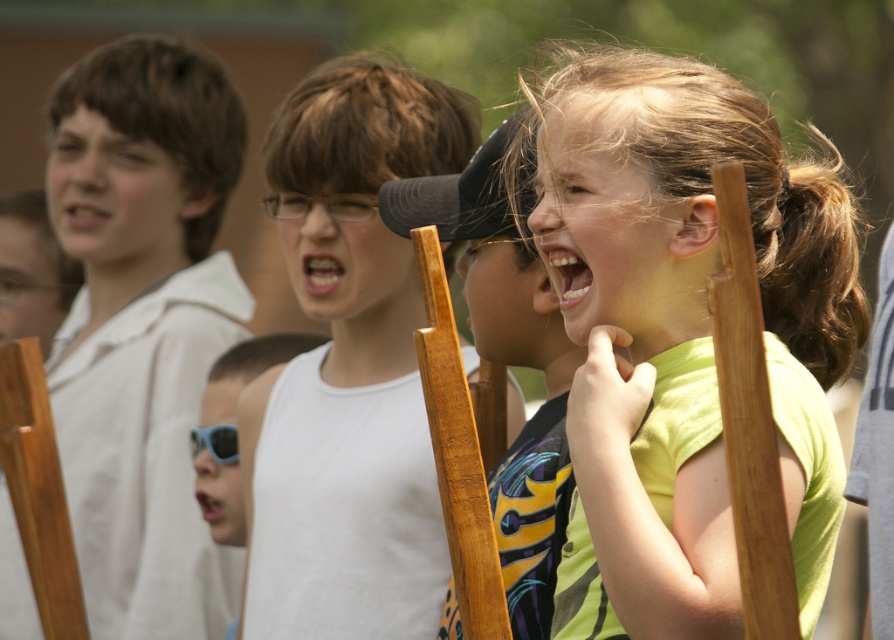
You are a photographer trying to capture a candid shot of the white matte tank top at center and the matte black cap at center. Which object should you adjust your focus on first to ensure both are in the frame?

The white matte tank top at center is closer to you than the matte black cap at center, so you should focus on the white matte tank top at center first to ensure both are in the frame.

You are a photographer setting up for a group photo. The green matte shirt at center and the matte black cap at center are part of the scene. If your camera has a minimum focus distance of 30 centimeters, can you focus on both objects simultaneously without needing to adjust the focus?

The green matte shirt at center and the matte black cap at center are 36.34 centimeters apart from each other. Since the distance between them is greater than the camera minimum focus distance of 30 centimeters, the camera can focus on both objects simultaneously without needing to adjust the focus.

You are a photographer trying to capture the perfect shot of the green matte shirt at center and the matte black cap at center. Based on their positions, which object should you focus on first to ensure both are in frame?

The green matte shirt at center is below the matte black cap at center, so you should focus on the matte black cap at center first to ensure both are in frame.